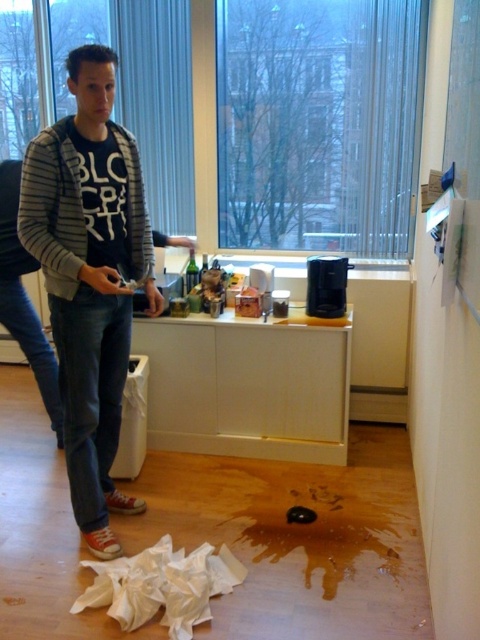
You are trying to decide whether to place a new decorative item on the counter. The striped cotton shirt at upper left and the white matte toilet paper at center are already there. Can you fit a rectangular item that is 10 cm wide between them?

The striped cotton shirt at upper left might be wider than white matte toilet paper at center, so the distance between them is uncertain. Without knowing the exact space between them, it is not possible to confirm if the 10 cm wide item will fit.

You are a photographer trying to capture a closeup shot of the striped cotton shirt at upper left. Given that your camera has a minimum focusing distance of 5 feet, will you be able to take the photo without moving the shirt or the camera?

The striped cotton shirt at upper left is 6.34 feet away from the camera, which is beyond the minimum focusing distance of 5 feet. Therefore, you can take the photo without moving either the shirt or the camera.

You are trying to locate the striped cotton shirt at upper left in the image. Based on the coordinates provided, where exactly should you look?

The striped cotton shirt at upper left is located at point coordinates of 0.433 in the x axis and 0.188 in the y axis.